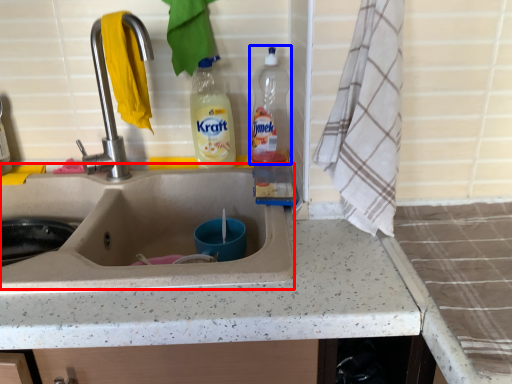
Question: Which of the following is the farthest to the observer, sink (highlighted by a red box) or bottle (highlighted by a blue box)?

Choices:
 (A) sink
 (B) bottle

Answer: (B)